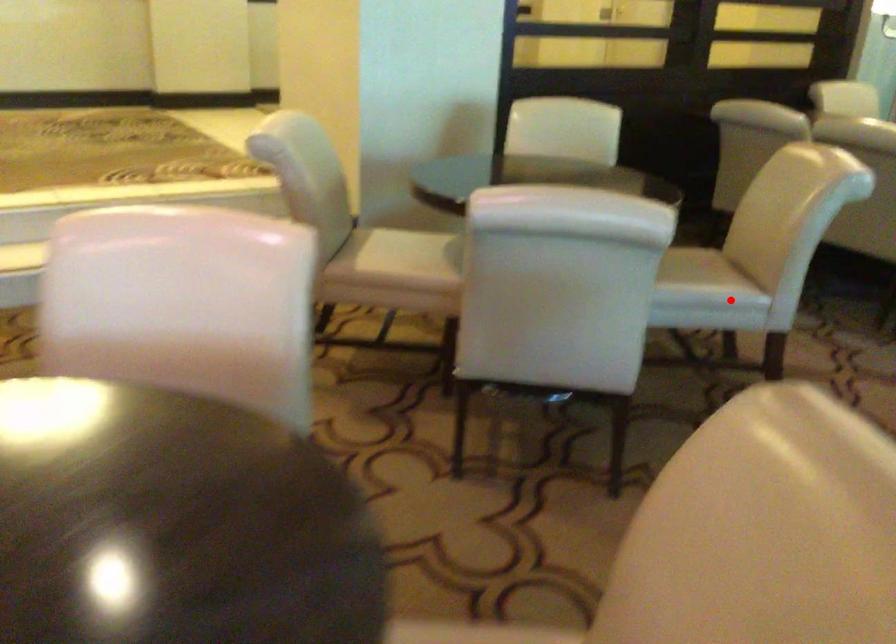
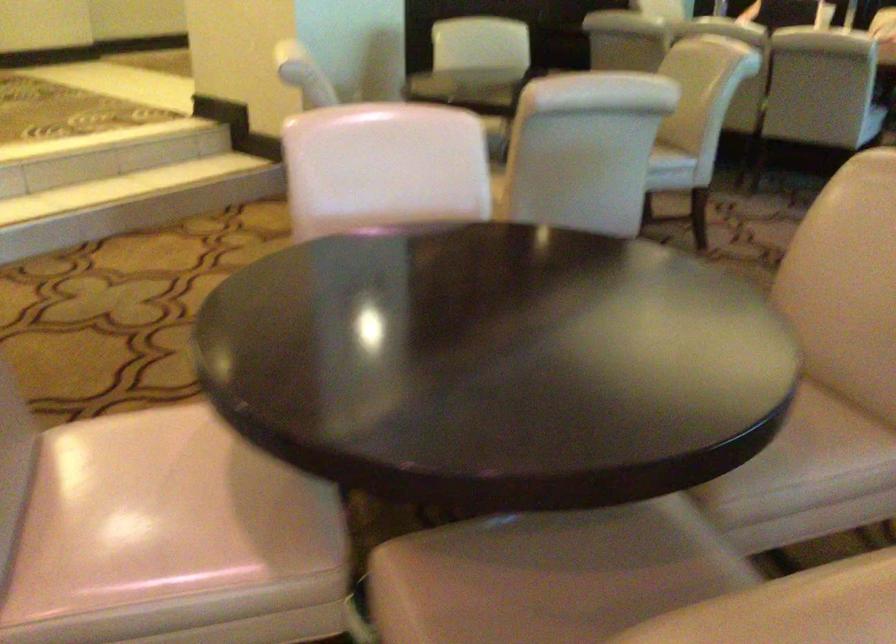
Question: A red point is marked in image1. In image2, is the corresponding 3D point closer to the camera or farther? Reply with the corresponding letter.

Choices:
 (A) The corresponding 3D point is closer.
 (B) The corresponding 3D point is farther.

Answer: (B)